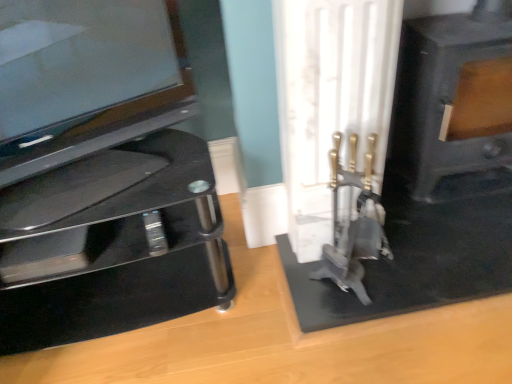
Question: Is black matte fireplace at right wider or thinner than black glass tv stand at left?

Choices:
 (A) wide
 (B) thin

Answer: (B)

Question: From a real-world perspective, is black matte fireplace at right positioned above or below black glass tv stand at left?

Choices:
 (A) below
 (B) above

Answer: (B)

Question: Which object is positioned farthest from the glossy black tv at left?

Choices:
 (A) black glass tv stand at left
 (B) black matte fireplace at right

Answer: (B)

Question: Which object is positioned closest to the glossy black tv at left?

Choices:
 (A) black glass tv stand at left
 (B) black matte fireplace at right

Answer: (A)